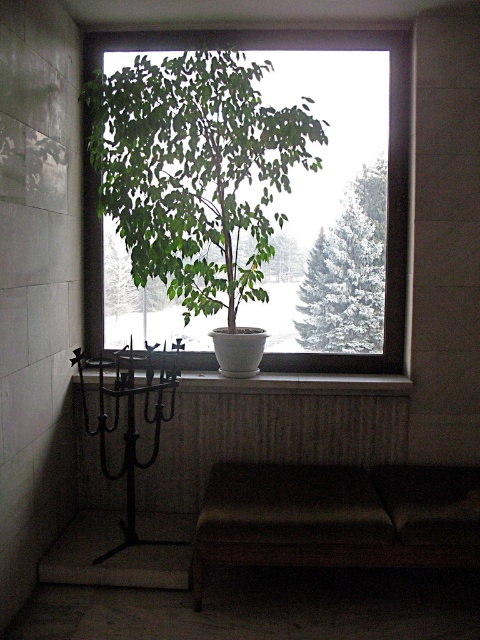
You are standing in the room and want to place a small decorative item exactly at the point marked as point (382, 292). Given that the room is 5 meters deep from the window to the back wall, is this point closer to the window or the back wall?

The distance of point (382, 292) from viewer is 3.18 meters. Since the room is 5 meters deep from the window to the back wall, the point is closer to the back wall because 3.18 meters is more than half of 5 meters.

You are standing in the room depicted in the image. You want to place a small decorative item exactly at the point marked as point (127,400). Considering the potted plant on the window sill and the black metal candel, which object is closer to this point?

The point (127,400) is 9.76 feet away from the camera. Since the potted plant on the window sill is centrally positioned and the black metal candel is to the left of the window, the black metal candel is closer to the point (127,400).

You are standing in the room and want to place a small decorative item on the windowsill. The item requires a space of 10 cm in width. Given the current setup, can you determine if there is enough space on the windowsill next to the green matte tree at center?

The green matte tree at center is positioned at point (348,273), but without knowing the dimensions of the windowsill or the size of the tree, it is impossible to determine if there is enough space for the decorative item.